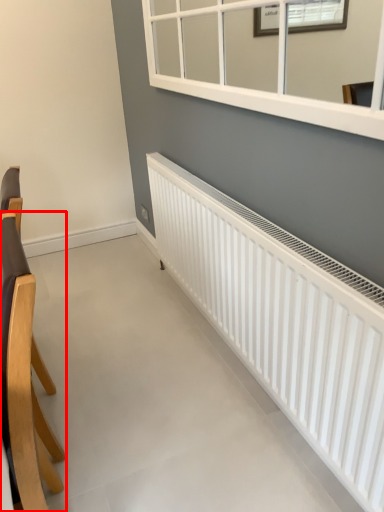
Question: In this image, where is chair (annotated by the red box) located relative to radiator?

Choices:
 (A) left
 (B) right

Answer: (A)